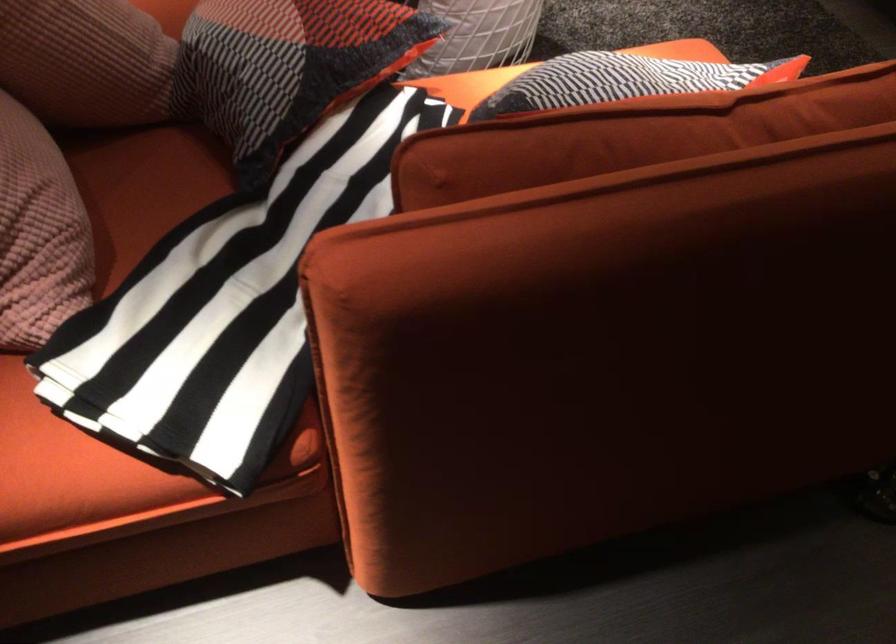
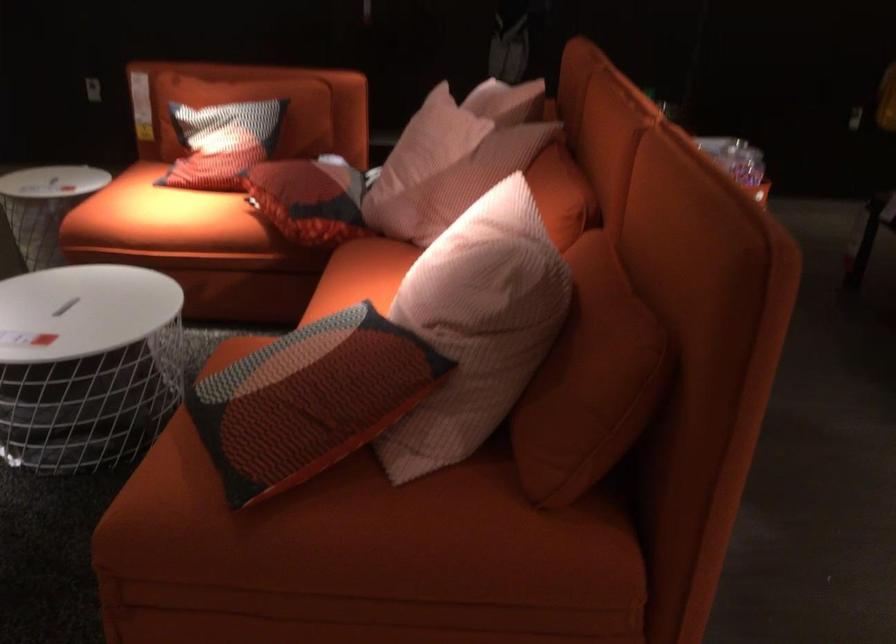
Question: I am providing you with two images of the same scene from different viewpoints. After the viewpoint changes to image2, which objects are now occluded?

Choices:
 (A) silver metal carafe
 (B) pink striped pillow
 (C) sofa sitting surface
 (D) red patterned pillow

Answer: (C)